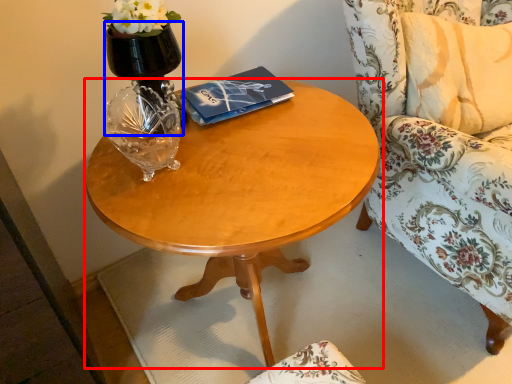
Question: Which object is further to the camera taking this photo, coffee table (highlighted by a red box) or vase (highlighted by a blue box)?

Choices:
 (A) coffee table
 (B) vase

Answer: (B)